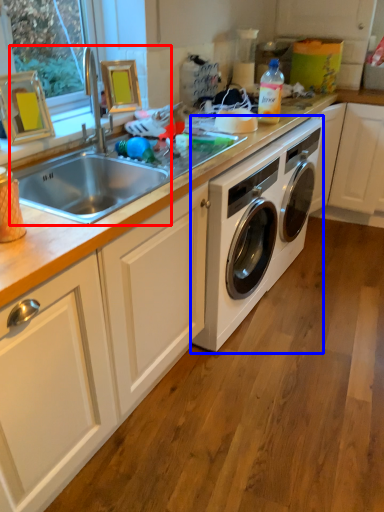
Question: Which object is closer to the camera taking this photo, sink (highlighted by a red box) or washing machine (highlighted by a blue box)?

Choices:
 (A) sink
 (B) washing machine

Answer: (A)